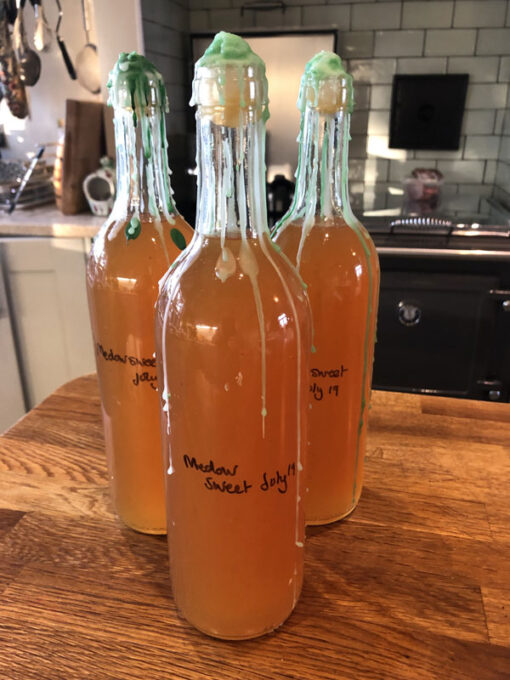
Identify the location of glass bottles. The height and width of the screenshot is (680, 510). (285, 315), (343, 432), (139, 445).